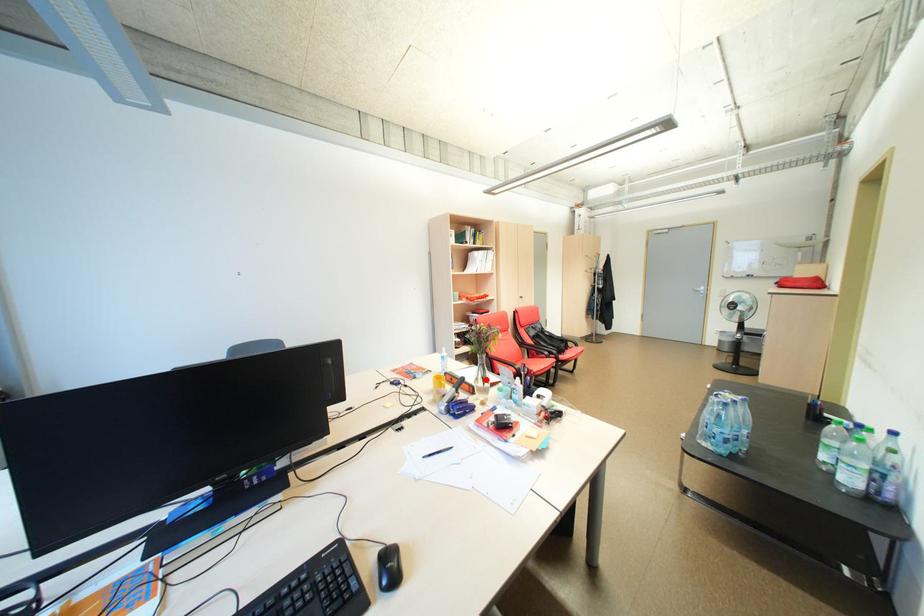
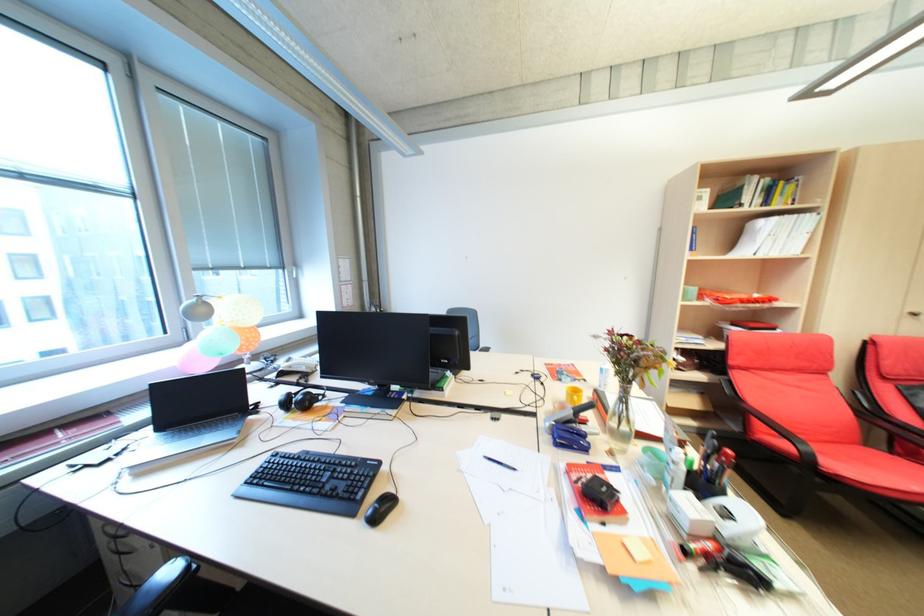
Question: I am providing you with two images of the same scene from different viewpoints. Given a red point in image1, look at the same physical point in image2. Is it:

Choices:
 (A) Closer to the viewpoint
 (B) Farther from the viewpoint

Answer: (A)